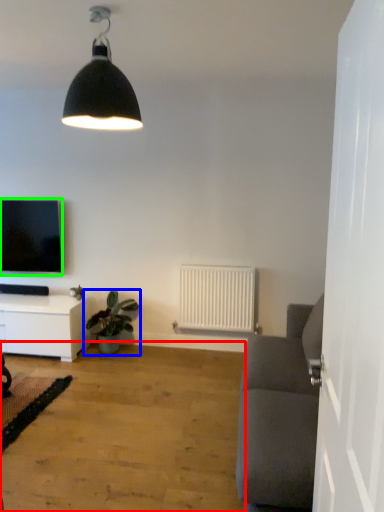
Question: Which object is the farthest from plain (highlighted by a red box)? Choose among these: houseplant (highlighted by a blue box) or television (highlighted by a green box).

Choices:
 (A) houseplant
 (B) television

Answer: (B)